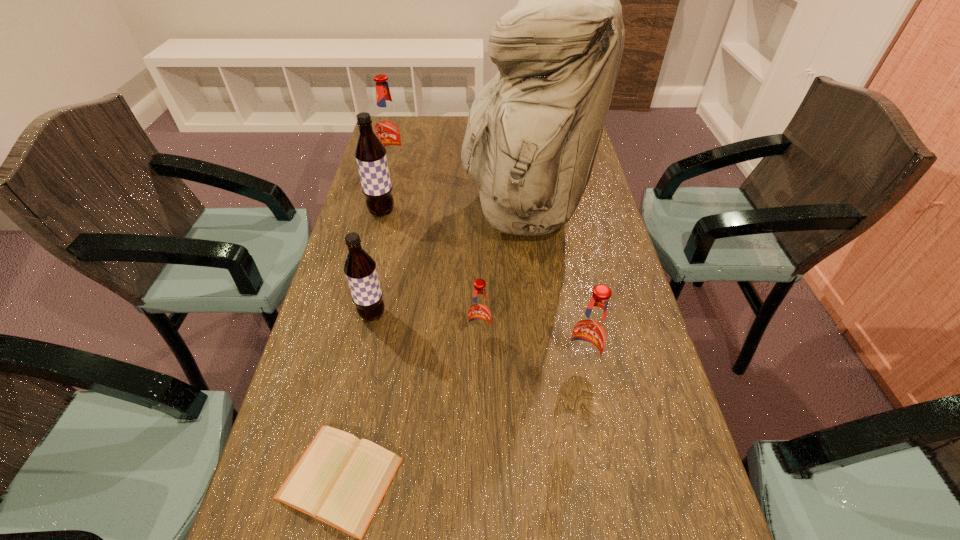
Locate an element on the screen. The image size is (960, 540). root beer that is the closest one to the nearest red root beer is located at coordinates tap(479, 312).

Find the location of a particular element. Image resolution: width=960 pixels, height=540 pixels. red root beer identified as the second closest to the backpack is located at coordinates (388, 128).

Identify which red root beer is the second nearest to the sixth farthest object. Please provide its 2D coordinates. Your answer should be formatted as a tuple, i.e. [(x, y)], where the tuple contains the x and y coordinates of a point satisfying the conditions above.

[(388, 128)]

You are a GUI agent. You are given a task and a screenshot of the screen. Output one action in this format:
    pyautogui.click(x=<x>, y=<y>)
    Task: Click on the second closest brown root beer to the backpack
    The height and width of the screenshot is (540, 960).
    Given the screenshot: What is the action you would take?
    pyautogui.click(x=360, y=269)

This screenshot has height=540, width=960. What are the coordinates of `brown root beer that is the second closest to the leftmost red root beer` in the screenshot? It's located at (360, 269).

I want to click on free space in the image that satisfies the following two spatial constraints: 1. on the back side of the leftmost red root beer; 2. on the left side of the fourth nearest root beer, so click(x=393, y=167).

At what (x,y) coordinates should I click in order to perform the action: click on vacant space that satisfies the following two spatial constraints: 1. on the back side of the sixth farthest object; 2. on the front-facing side of the backpack. Please return your answer as a coordinate pair (x, y). This screenshot has height=540, width=960. Looking at the image, I should click on [552, 209].

Locate an element on the screen. vacant space that satisfies the following two spatial constraints: 1. on the front side of the nearest red root beer; 2. on the right side of the bigger brown root beer is located at coordinates point(344,367).